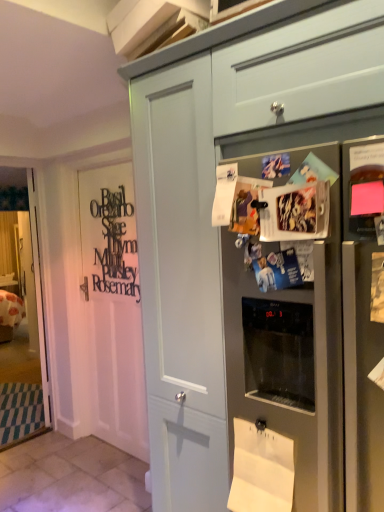
Question: From their relative heights in the image, would you say white paper at lower center is taller or shorter than clear glass door at left?

Choices:
 (A) tall
 (B) short

Answer: (B)

Question: From the image's perspective, is white paper at lower center located above or below clear glass door at left?

Choices:
 (A) above
 (B) below

Answer: (B)

Question: Estimate the real-world distances between objects in this image. Which object is closer to the matte gray drawer at upper center?

Choices:
 (A) black wood sign at left
 (B) satin silver refrigerator at upper right
 (C) white paper at lower center
 (D) clear glass door at left
 (E) matte gray cabinet at center

Answer: (E)

Question: Which of these objects is positioned farthest from the matte gray drawer at upper center?

Choices:
 (A) white wood door at left
 (B) clear glass door at left
 (C) matte gray cabinet at center
 (D) black wood sign at left
 (E) satin silver refrigerator at upper right

Answer: (B)